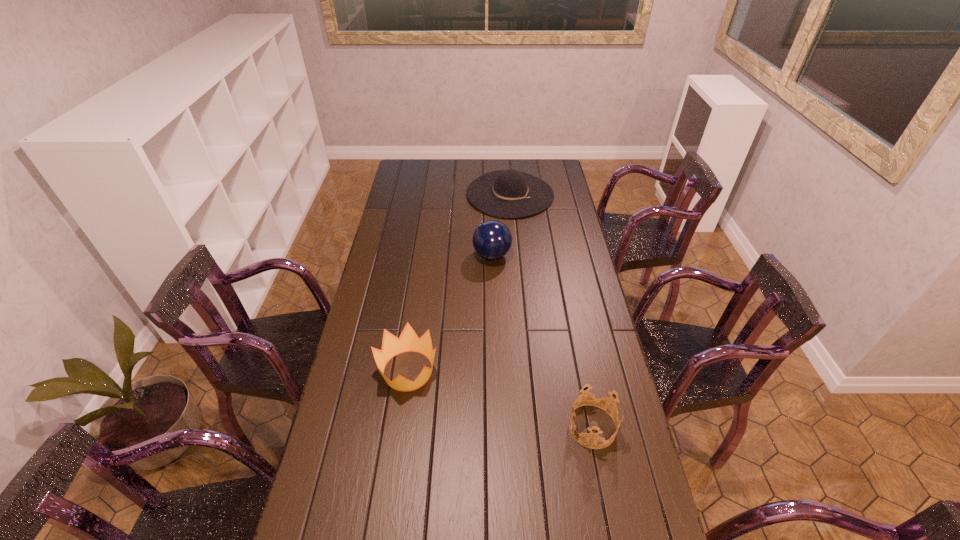
Locate an element on the screen. Image resolution: width=960 pixels, height=540 pixels. free region located 0.400m on the front-facing side of the farthest object is located at coordinates (517, 280).

Where is `free location located 0.380m on the right of the farther crown`? free location located 0.380m on the right of the farther crown is located at coordinates (557, 370).

This screenshot has height=540, width=960. Identify the location of free spot located 0.250m on the left of the right crown. (482, 427).

This screenshot has height=540, width=960. I want to click on object that is at the far edge, so click(x=509, y=193).

Where is `object located at the left edge`? object located at the left edge is located at coordinates (408, 341).

Locate an element on the screen. The height and width of the screenshot is (540, 960). sombrero that is at the right edge is located at coordinates tap(509, 193).

Image resolution: width=960 pixels, height=540 pixels. What are the coordinates of `crown positioned at the right edge` in the screenshot? It's located at click(602, 396).

This screenshot has width=960, height=540. Identify the location of object that is positioned at the far right corner. (509, 193).

In the image, there is a desktop. Where is `free space at the far edge`? This screenshot has width=960, height=540. free space at the far edge is located at coordinates (510, 166).

You are a GUI agent. You are given a task and a screenshot of the screen. Output one action in this format:
    pyautogui.click(x=<x>, y=<y>)
    Task: Click on the vacant space at the left edge of the desktop
    This screenshot has height=540, width=960.
    Given the screenshot: What is the action you would take?
    pyautogui.click(x=354, y=390)